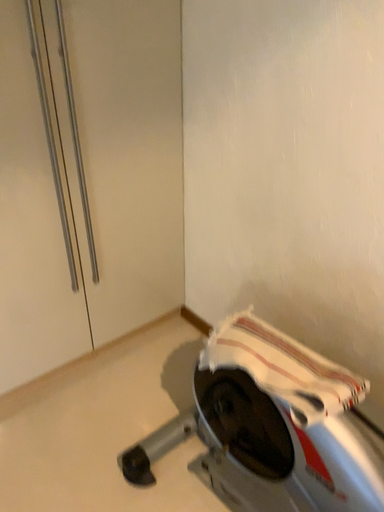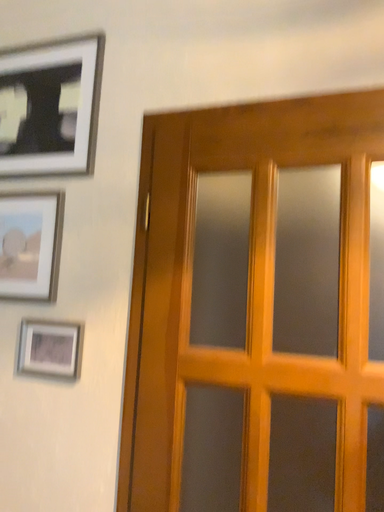
Question: How did the camera likely rotate when shooting the video?

Choices:
 (A) rotated right
 (B) rotated left

Answer: (A)